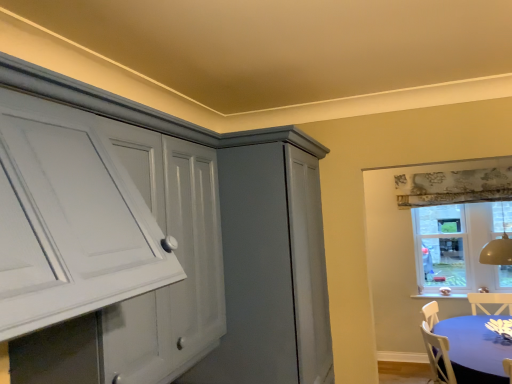
What do you see at coordinates (475, 349) in the screenshot? I see `blue fabric table at lower right` at bounding box center [475, 349].

Where is `blue fabric table at lower right`? This screenshot has height=384, width=512. blue fabric table at lower right is located at coordinates (475, 349).

Image resolution: width=512 pixels, height=384 pixels. In order to click on clear glass window at upper right in this screenshot , I will do `click(458, 247)`.

Describe the element at coordinates (458, 247) in the screenshot. I see `clear glass window at upper right` at that location.

Locate an element on the screen. This screenshot has height=384, width=512. blue fabric table at lower right is located at coordinates (475, 349).

Visually, is blue fabric table at lower right positioned to the left or to the right of clear glass window at upper right?

blue fabric table at lower right is to the left of clear glass window at upper right.

Does blue fabric table at lower right come in front of clear glass window at upper right?

That is True.

Does point (455, 362) come in front of point (460, 220)?

Yes, point (455, 362) is in front of point (460, 220).

From the image's perspective, relative to clear glass window at upper right, is blue fabric table at lower right above or below?

From the image's perspective, blue fabric table at lower right appears below clear glass window at upper right.

From a real-world perspective, who is located lower, blue fabric table at lower right or clear glass window at upper right?

blue fabric table at lower right.

In terms of width, does blue fabric table at lower right look wider or thinner when compared to clear glass window at upper right?

Considering their sizes, blue fabric table at lower right looks broader than clear glass window at upper right.

Considering the sizes of objects blue fabric table at lower right and clear glass window at upper right in the image provided, who is taller, blue fabric table at lower right or clear glass window at upper right?

With more height is clear glass window at upper right.

Considering the relative sizes of blue fabric table at lower right and clear glass window at upper right in the image provided, is blue fabric table at lower right bigger than clear glass window at upper right?

Correct, blue fabric table at lower right is larger in size than clear glass window at upper right.

Is blue fabric table at lower right inside the boundaries of clear glass window at upper right, or outside?

blue fabric table at lower right is not inside clear glass window at upper right, it's outside.

Consider the image. Is blue fabric table at lower right far from clear glass window at upper right?

Yes, blue fabric table at lower right and clear glass window at upper right are quite far apart.

In the scene shown: Could you tell me if blue fabric table at lower right is turned towards clear glass window at upper right?

No, blue fabric table at lower right is not turned towards clear glass window at upper right.

What's the angular difference between blue fabric table at lower right and clear glass window at upper right's facing directions?

They differ by 1.98 degrees in their facing directions.

How distant is blue fabric table at lower right from clear glass window at upper right?

blue fabric table at lower right is 2.00 meters from clear glass window at upper right.

At what (x,y) coordinates should I click in order to perform the action: click on window located above the blue fabric table at lower right (from a real-world perspective). Please return your answer as a coordinate pair (x, y). Looking at the image, I should click on coord(458,247).

Which object is positioned more to the right, clear glass window at upper right or blue fabric table at lower right?

Positioned to the right is clear glass window at upper right.

Is the depth of clear glass window at upper right less than that of blue fabric table at lower right?

No, clear glass window at upper right is further to the viewer.

Is point (455, 267) behind point (450, 352)?

Yes, it is behind point (450, 352).

From the image's perspective, between clear glass window at upper right and blue fabric table at lower right, which one is located above?

clear glass window at upper right, from the image's perspective.

From a real-world perspective, which is physically above, clear glass window at upper right or blue fabric table at lower right?

From a 3D spatial view, clear glass window at upper right is above.

Does clear glass window at upper right have a lesser width compared to blue fabric table at lower right?

Indeed, clear glass window at upper right has a lesser width compared to blue fabric table at lower right.

Is clear glass window at upper right shorter than blue fabric table at lower right?

No, clear glass window at upper right is not shorter than blue fabric table at lower right.

Is clear glass window at upper right smaller than blue fabric table at lower right?

Correct, clear glass window at upper right occupies less space than blue fabric table at lower right.

Is clear glass window at upper right spatially inside blue fabric table at lower right, or outside of it?

clear glass window at upper right lies outside blue fabric table at lower right.

Is clear glass window at upper right far away from blue fabric table at lower right?

Yes, clear glass window at upper right is far from blue fabric table at lower right.

Is clear glass window at upper right oriented away from blue fabric table at lower right?

No, clear glass window at upper right's orientation is not away from blue fabric table at lower right.

What's the angular difference between clear glass window at upper right and blue fabric table at lower right's facing directions?

1.98 degrees separate the facing orientations of clear glass window at upper right and blue fabric table at lower right.

Measure the distance between clear glass window at upper right and blue fabric table at lower right.

They are 6.55 feet apart.

The image size is (512, 384). Identify the location of table in front of the clear glass window at upper right. (475, 349).

Identify the location of window behind the blue fabric table at lower right. (458, 247).

Find the location of `window located above the blue fabric table at lower right (from a real-world perspective)`. window located above the blue fabric table at lower right (from a real-world perspective) is located at coordinates (458, 247).